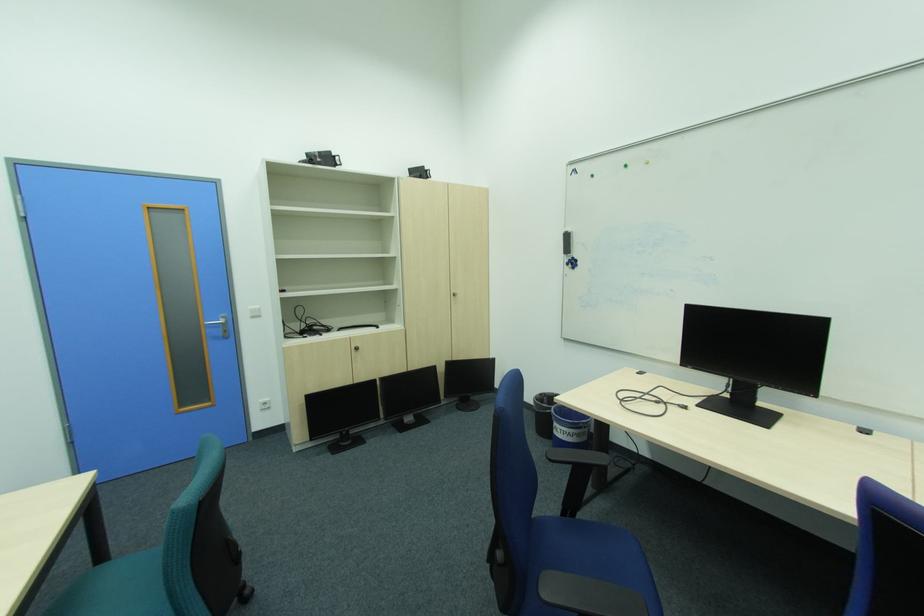
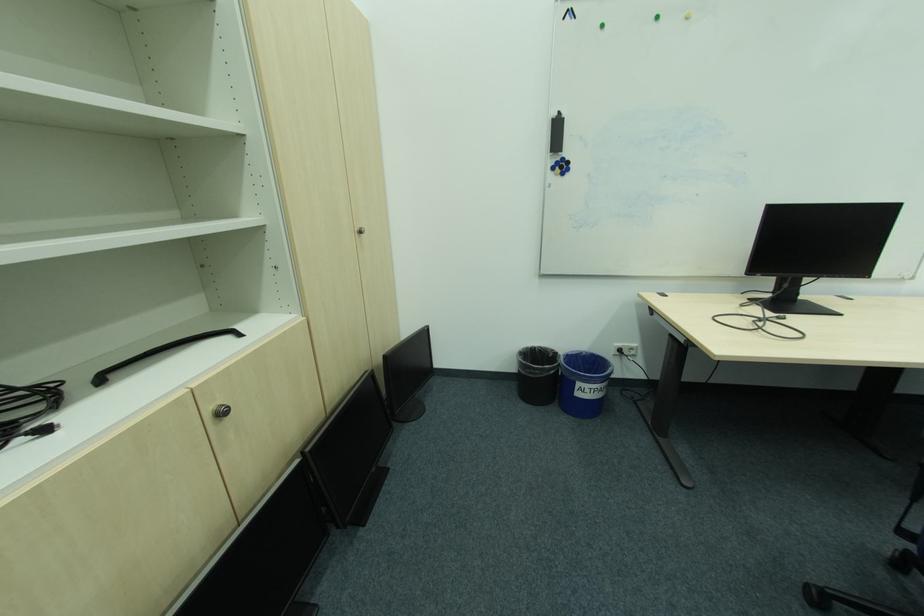
Find the pixel in the second image that matches point (577, 261) in the first image.

(565, 163)